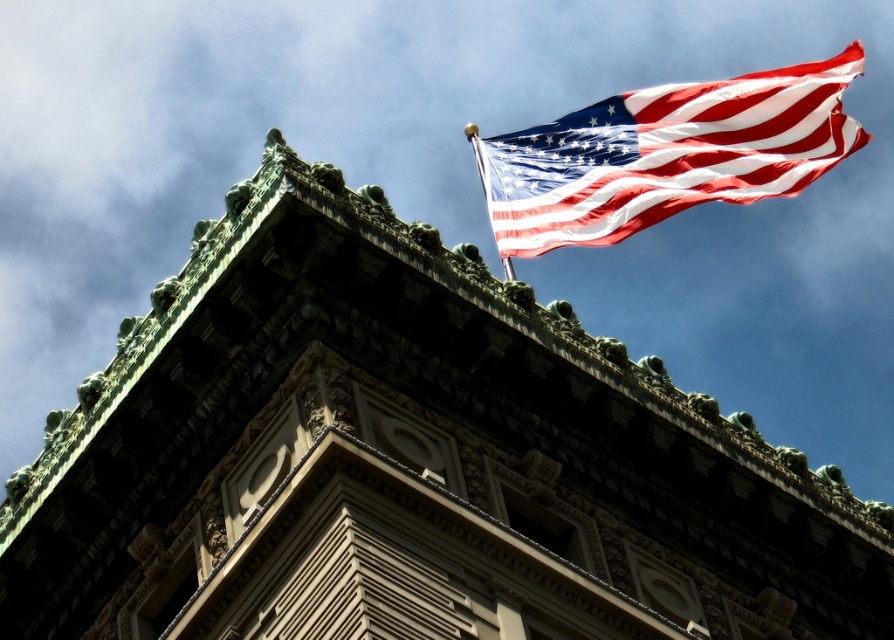
Is red-white striped fabric at upper right further to the viewer compared to metallic silver flag pole at upper right?

Yes, red-white striped fabric at upper right is behind metallic silver flag pole at upper right.

Is point (597, 134) more distant than point (485, 173)?

No, (597, 134) is in front of (485, 173).

Identify the location of red-white striped fabric at upper right. The height and width of the screenshot is (640, 894). (665, 154).